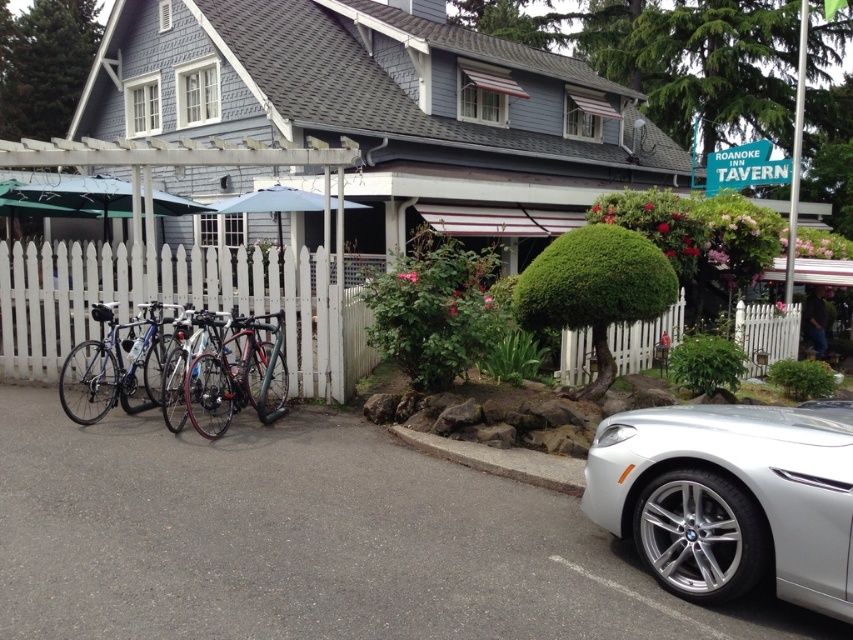
Question: Which of the following is the farthest from the observer?

Choices:
 (A) white picket fence at left
 (B) shiny black bicycle at center

Answer: (A)

Question: Which is nearer to the silver metallic car at lower right?

Choices:
 (A) white picket fence at center
 (B) shiny silver bicycle at left
 (C) shiny black bicycle at center

Answer: (C)

Question: Is shiny black bicycle at center behind shiny silver bicycle at left?

Choices:
 (A) no
 (B) yes

Answer: (A)

Question: Which point is closer to the camera?

Choices:
 (A) (247, 268)
 (B) (225, 420)
 (C) (164, 339)
 (D) (164, 412)

Answer: (D)

Question: Does shiny black bicycle at center have a larger size compared to shiny silver bicycle at left?

Choices:
 (A) yes
 (B) no

Answer: (B)

Question: Does silver metallic car at lower right have a greater width compared to shiny silver bicycle at center?

Choices:
 (A) no
 (B) yes

Answer: (B)